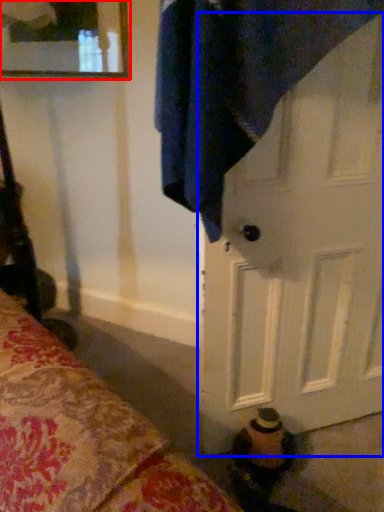
Question: Which point is closer to the camera, mirror (highlighted by a red box) or door (highlighted by a blue box)?

Choices:
 (A) mirror
 (B) door

Answer: (B)